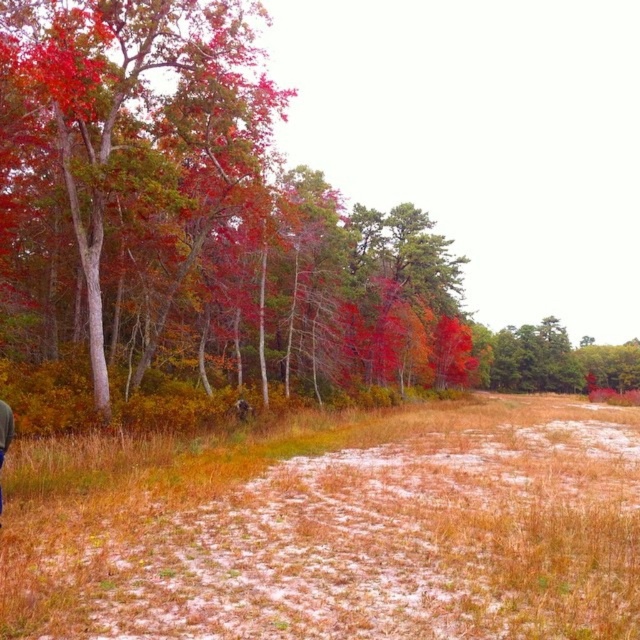
You are standing in the autumnal landscape and see the brown grass at center and the denim jacket at lower left. Which object is closer to you?

The denim jacket at lower left is closer to you because it is positioned above the brown grass at center, which is under it.

You are an artist planning to paint the autumn scene. You have a brush that can cover an area of 10 cm. You need to paint both the autumn leaves at left and the brown grass at center. Which object requires a larger brush to cover its width?

The autumn leaves at left might be wider than brown grass at center, so you should use a larger brush for the autumn leaves at left to ensure proper coverage.